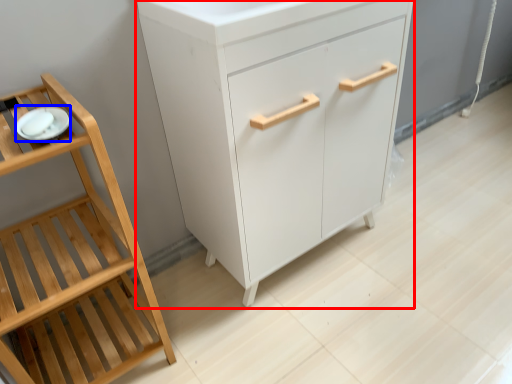
Question: Which object is further to the camera taking this photo, chest of drawers (highlighted by a red box) or tableware (highlighted by a blue box)?

Choices:
 (A) chest of drawers
 (B) tableware

Answer: (A)